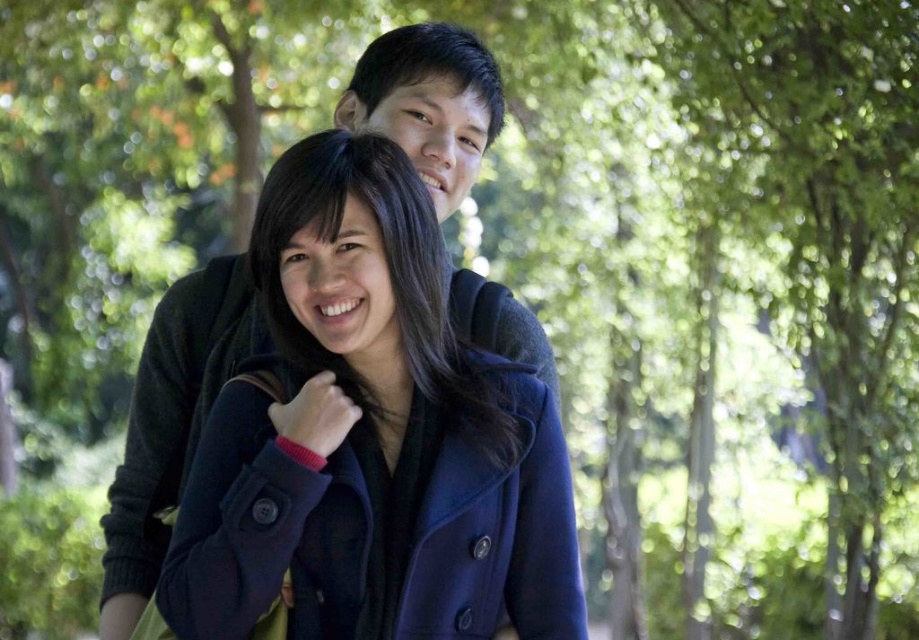
Does navy wool coat at center have a smaller size compared to green leafy tree at upper center?

Indeed, navy wool coat at center has a smaller size compared to green leafy tree at upper center.

Is point (412, 516) less distant than point (727, 20)?

Yes, it is in front of point (727, 20).

This screenshot has height=640, width=919. What are the coordinates of `navy wool coat at center` in the screenshot? It's located at (371, 436).